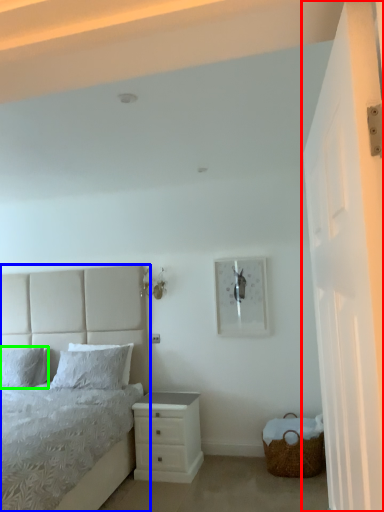
Question: Which object is the farthest from glass door (highlighted by a red box)? Choose among these: bed (highlighted by a blue box) or pillow (highlighted by a green box).

Choices:
 (A) bed
 (B) pillow

Answer: (B)